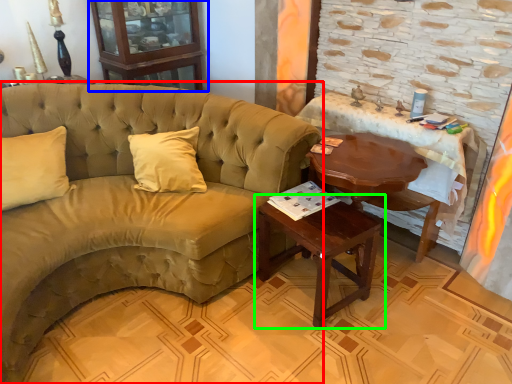
Question: Considering the real-world distances, which object is closest to studio couch (highlighted by a red box)? armoire (highlighted by a blue box) or table (highlighted by a green box).

Choices:
 (A) armoire
 (B) table

Answer: (B)